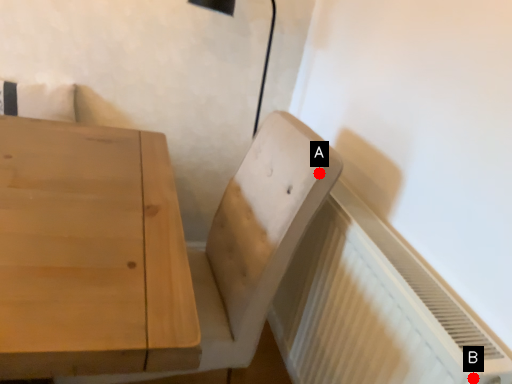
Question: Two points are circled on the image, labeled by A and B beside each circle. Which of the following is the closest to the observer?

Choices:
 (A) A is closer
 (B) B is closer

Answer: (B)